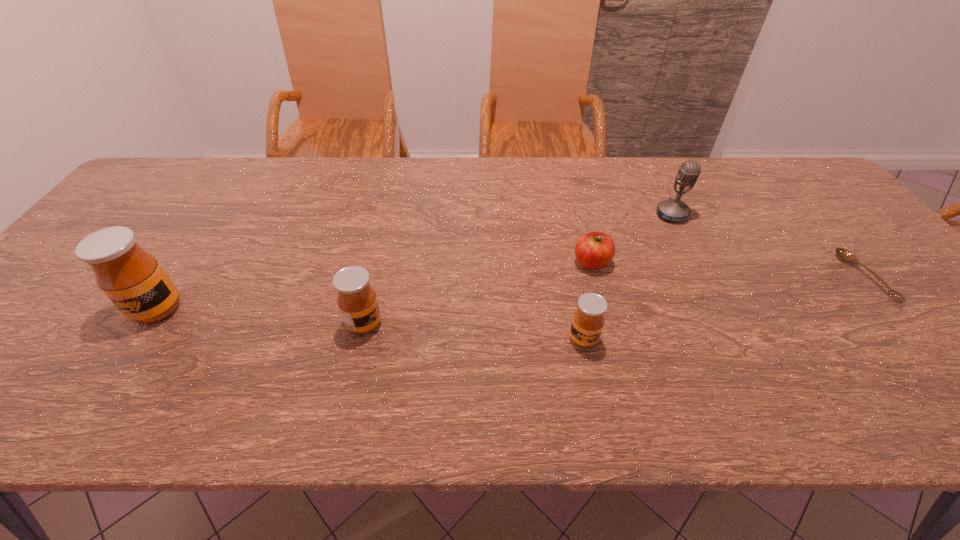
Please point a spot on the right to add another honey. Please provide its 2D coordinates. Your answer should be formatted as a tuple, i.e. [(x, y)], where the tuple contains the x and y coordinates of a point satisfying the conditions above.

[(816, 355)]